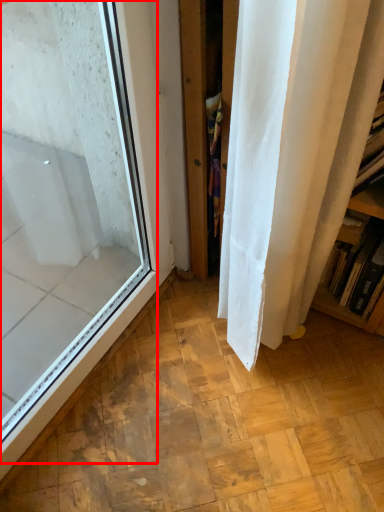
Question: Considering the relative positions of window (annotated by the red box) and bookshelf in the image provided, where is window (annotated by the red box) located with respect to the staircase?

Choices:
 (A) right
 (B) left

Answer: (B)